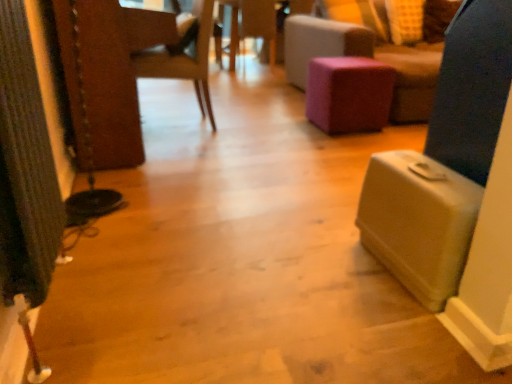
Question: In terms of size, does beige plastic suitcase at lower right appear bigger or smaller than wooden chair at center?

Choices:
 (A) small
 (B) big

Answer: (A)

Question: From the image's perspective, relative to wooden chair at center, is beige plastic suitcase at lower right above or below?

Choices:
 (A) above
 (B) below

Answer: (B)

Question: Considering the real-world distances, which object is farthest from the purple fabric stool at center?

Choices:
 (A) beige plastic suitcase at lower right
 (B) wooden chair at center
 (C) wooden side table at center
 (D) purple fabric ottoman at center

Answer: (C)

Question: Which is nearer to the purple fabric stool at center?

Choices:
 (A) wooden side table at center
 (B) wooden chair at center
 (C) purple fabric ottoman at center
 (D) beige plastic suitcase at lower right

Answer: (C)